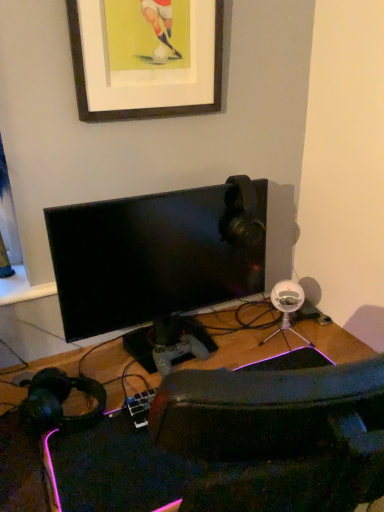
Question: Is wooden picture frame at upper center completely or partially outside of black glossy monitor at center?

Choices:
 (A) yes
 (B) no

Answer: (A)

Question: Considering the relative sizes of wooden picture frame at upper center and black glossy monitor at center in the image provided, is wooden picture frame at upper center wider than black glossy monitor at center?

Choices:
 (A) no
 (B) yes

Answer: (A)

Question: Is the position of wooden picture frame at upper center more distant than that of black glossy monitor at center?

Choices:
 (A) no
 (B) yes

Answer: (A)

Question: Is wooden picture frame at upper center to the right of black glossy monitor at center from the viewer's perspective?

Choices:
 (A) no
 (B) yes

Answer: (A)

Question: Does wooden picture frame at upper center turn towards black glossy monitor at center?

Choices:
 (A) yes
 (B) no

Answer: (B)

Question: From a real-world perspective, is black matte headphones at lower left physically located above or below wooden picture frame at upper center?

Choices:
 (A) below
 (B) above

Answer: (A)

Question: Considering their positions, is black matte headphones at lower left located in front of or behind wooden picture frame at upper center?

Choices:
 (A) front
 (B) behind

Answer: (A)

Question: Is black matte headphones at lower left situated inside wooden picture frame at upper center or outside?

Choices:
 (A) inside
 (B) outside

Answer: (B)

Question: Is point [x=99, y=415] positioned closer to the camera than point [x=87, y=13]?

Choices:
 (A) farther
 (B) closer

Answer: (A)

Question: Is point (233, 211) closer or farther from the camera than point (273, 443)?

Choices:
 (A) farther
 (B) closer

Answer: (A)

Question: From a real-world perspective, is black glossy monitor at center positioned above or below wooden desk at center?

Choices:
 (A) above
 (B) below

Answer: (A)

Question: Would you say black glossy monitor at center is inside or outside wooden desk at center?

Choices:
 (A) outside
 (B) inside

Answer: (A)

Question: Considering the positions of black glossy monitor at center and wooden desk at center in the image, is black glossy monitor at center wider or thinner than wooden desk at center?

Choices:
 (A) wide
 (B) thin

Answer: (B)

Question: From the image's perspective, relative to wooden desk at center, is wooden picture frame at upper center above or below?

Choices:
 (A) below
 (B) above

Answer: (B)

Question: In the image, is wooden picture frame at upper center on the left side or the right side of wooden desk at center?

Choices:
 (A) right
 (B) left

Answer: (B)